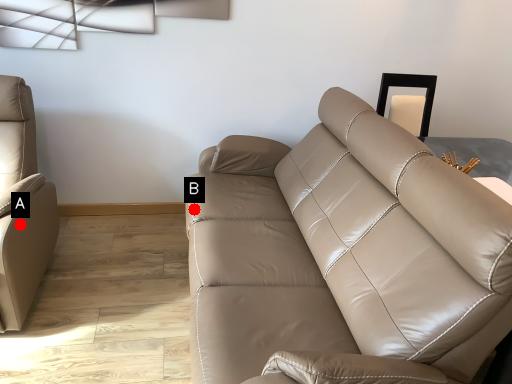
Question: Two points are circled on the image, labeled by A and B beside each circle. Which point appears farthest from the camera in this image?

Choices:
 (A) A is further
 (B) B is further

Answer: (B)